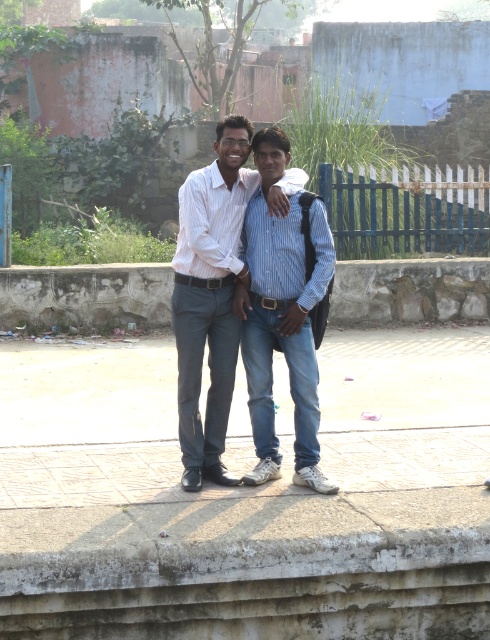
You are taking a photo of two people standing on a paved path bordered by a stone wall. The scene includes two points marked as point 1 at coordinates (214, 234) and point 2 at coordinates (375, 209). If you want to focus on the person closer to the camera, which point should you adjust your camera focus to?

Point 1 at coordinates (214, 234) is closer to the camera than point 2 at coordinates (375, 209), so you should focus on point 1 to capture the person closer to the camera.

You are a delivery drone trying to locate the matte white shirt at center. According to the coordinates provided, where would you find it?

The matte white shirt at center is located at coordinates point (210,298).

You are standing on the paved area and want to take a photo of the blue striped shirt at center and the blue painted wood fence at upper center. Which object should you point the camera towards first if you start from the left side of the scene?

You should point the camera towards the blue striped shirt at center first because it is located to the left of the blue painted wood fence at upper center.